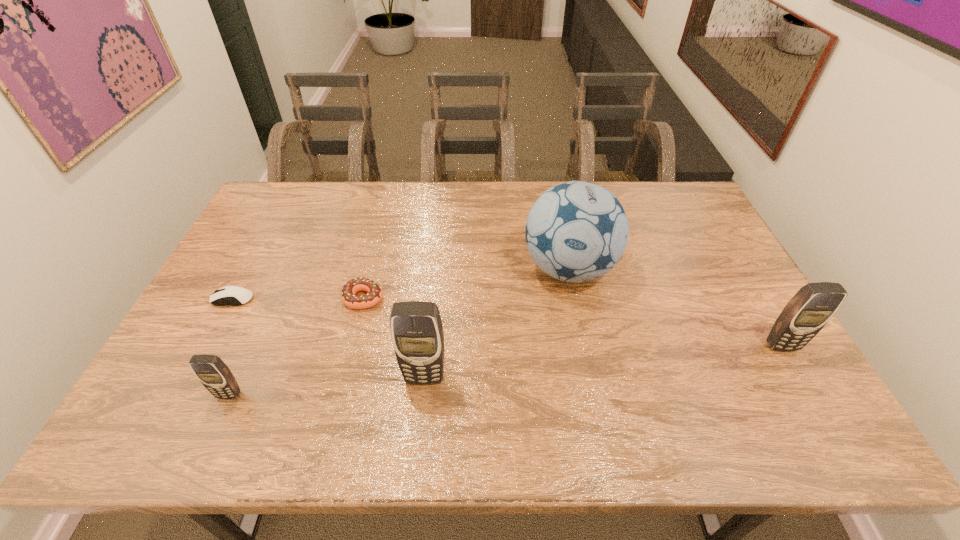
This screenshot has height=540, width=960. Identify the location of vacant space at the near edge. (356, 368).

Locate an element on the screen. The height and width of the screenshot is (540, 960). vacant space at the left edge of the desktop is located at coordinates (209, 294).

This screenshot has width=960, height=540. Identify the location of vacant space at the far left corner of the desktop. (281, 181).

Where is `free space at the far right corner`? This screenshot has width=960, height=540. free space at the far right corner is located at coordinates [x=672, y=202].

At what (x,y) coordinates should I click in order to perform the action: click on unoccupied position between the second cellular telephone from right to left and the third nearest object. Please return your answer as a coordinate pair (x, y). Looking at the image, I should click on point(603,362).

At what (x,y) coordinates should I click in order to perform the action: click on free point between the nearest cellular telephone and the second tallest cellular telephone. Please return your answer as a coordinate pair (x, y). Image resolution: width=960 pixels, height=540 pixels. Looking at the image, I should click on (505, 370).

At what (x,y) coordinates should I click in order to perform the action: click on vacant point located between the second cellular telephone from left to right and the fifth object from left to right. Please return your answer as a coordinate pair (x, y). Looking at the image, I should click on (496, 323).

Identify the location of vacant area that lies between the third object from right to left and the rightmost object. (603, 362).

At what (x,y) coordinates should I click in order to perform the action: click on vacant space in between the doughnut and the nearest cellular telephone. Please return your answer as a coordinate pair (x, y). Looking at the image, I should click on (297, 346).

What are the coordinates of `vacant region between the doughnut and the second object from right to left` in the screenshot? It's located at (467, 284).